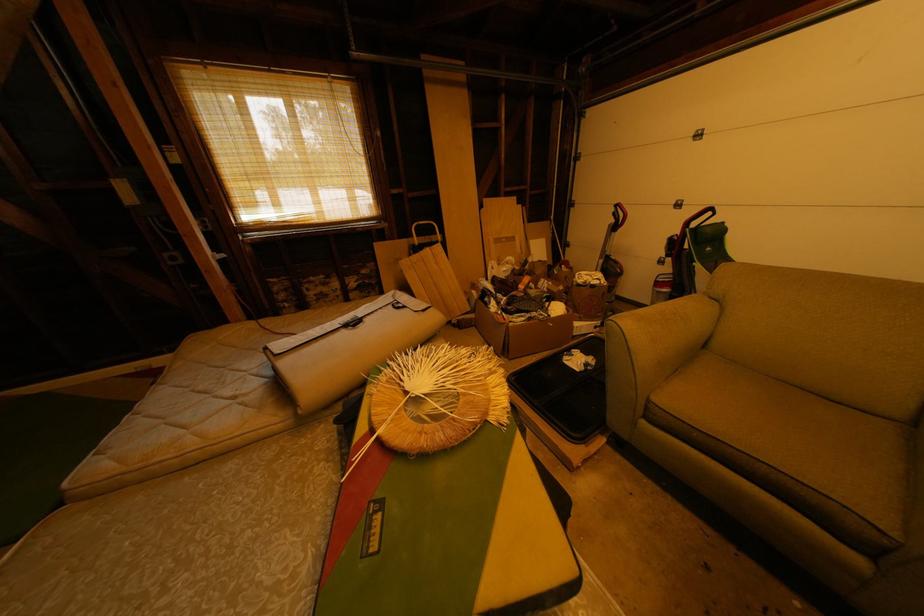
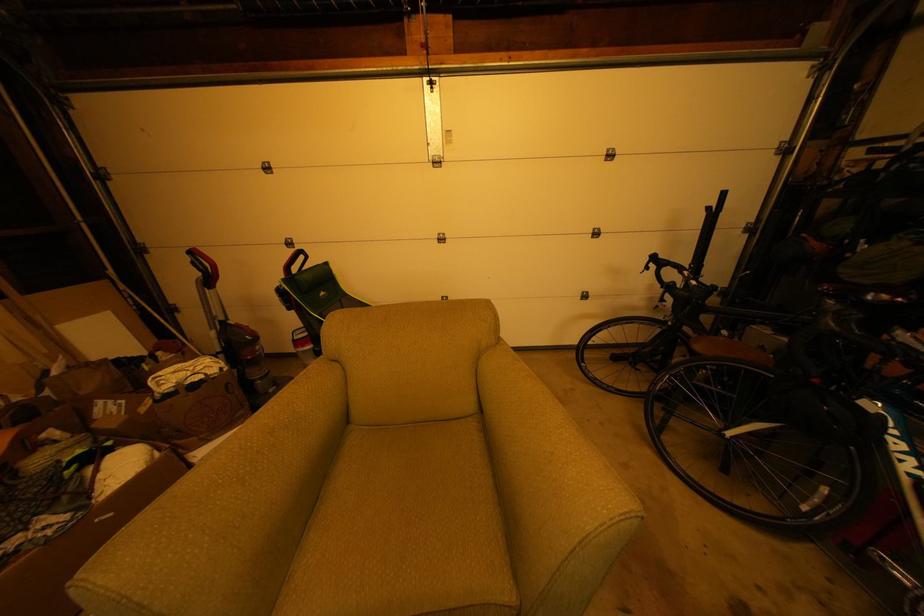
Question: The images are taken continuously from a first-person perspective. In which direction is your viewpoint rotating?

Choices:
 (A) Left
 (B) Right
 (C) Up
 (D) Down

Answer: (B)